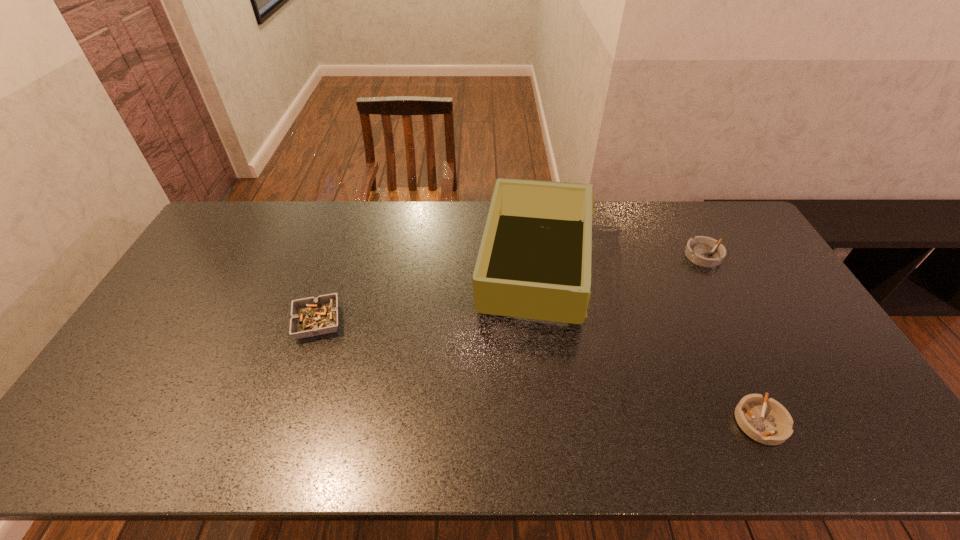
Select which ashtray is the third closest to the third object from right to left. Please provide its 2D coordinates. Your answer should be formatted as a tuple, i.e. [(x, y)], where the tuple contains the x and y coordinates of a point satisfying the conditions above.

[(311, 316)]

Select which ashtray is the closest to the nearest object. Please provide its 2D coordinates. Your answer should be formatted as a tuple, i.e. [(x, y)], where the tuple contains the x and y coordinates of a point satisfying the conditions above.

[(704, 251)]

Identify the location of vacant space that satisfies the following two spatial constraints: 1. on the back side of the leftmost ashtray; 2. on the right side of the tallest object. 336,268.

Locate an element on the screen. free space that satisfies the following two spatial constraints: 1. on the front side of the second object from left to right; 2. on the right side of the nearest ashtray is located at coordinates (553, 422).

Find the location of `vacant space that satisfies the following two spatial constraints: 1. on the front side of the leftmost object; 2. on the left side of the nearest object`. vacant space that satisfies the following two spatial constraints: 1. on the front side of the leftmost object; 2. on the left side of the nearest object is located at coordinates (284, 422).